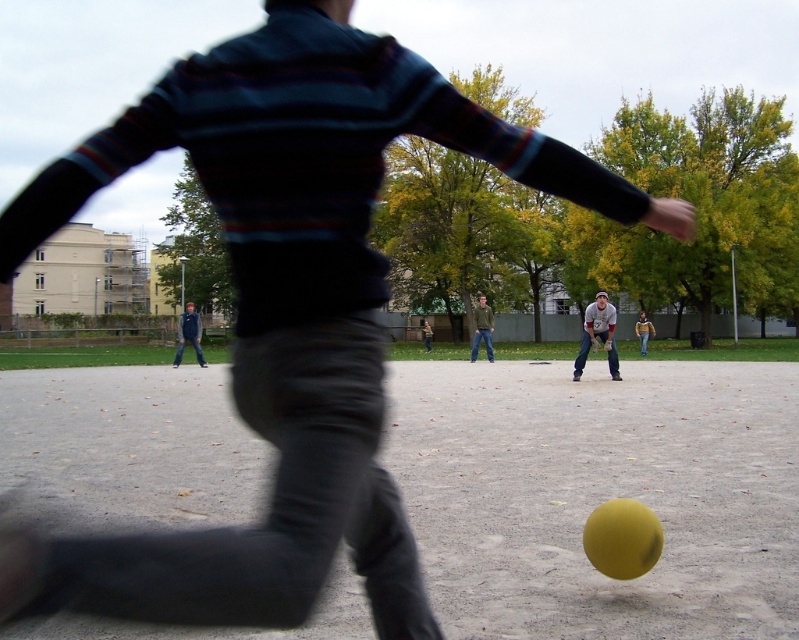
You are a photographer trying to capture the action of the game. You need to focus on the dark blue jeans at center and denim jacket at center. Which object should you zoom in on to ensure the entire subject fits in the frame if your camera has limited zoom range?

The denim jacket at center should be zoomed in on because it is narrower than the dark blue jeans at center, making it easier to fit within the camera frame with limited zoom range.

You are a referee in a kickball game and need to ensure players are positioned correctly. The gray cotton shirt at center and denim jacket at center must be at least 10 meters apart. Are they positioned correctly?

The gray cotton shirt at center and denim jacket at center are 9.53 meters apart, which is less than the required 10 meters. They are not positioned correctly.